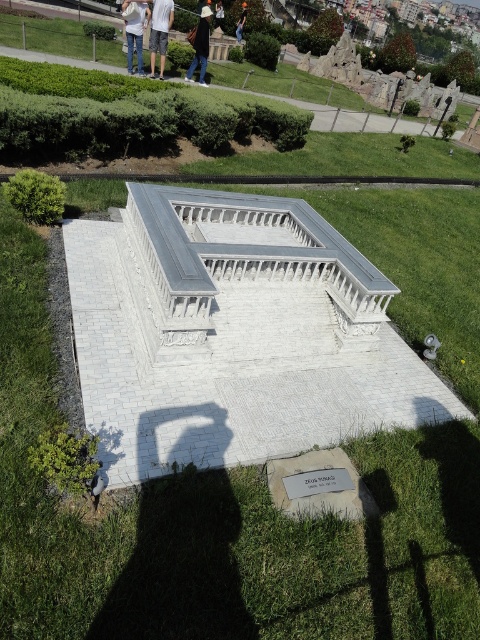
Question: Which object appears farthest from the camera in this image?

Choices:
 (A) white cotton shorts at center
 (B) black fabric bag at upper center
 (C) jeans at center
 (D) black cotton shirt at upper center

Answer: (D)

Question: Can you confirm if white cotton shorts at center is bigger than black fabric bag at upper center?

Choices:
 (A) no
 (B) yes

Answer: (B)

Question: Which of the following is the farthest from the observer?

Choices:
 (A) black fabric bag at upper center
 (B) jeans at center
 (C) black cotton shirt at upper center

Answer: (C)

Question: Can you confirm if jeans at center is smaller than black cotton shirt at upper center?

Choices:
 (A) yes
 (B) no

Answer: (A)

Question: Which is farther from the white cotton shorts at center?

Choices:
 (A) black fabric bag at upper center
 (B) black cotton shirt at upper center

Answer: (B)

Question: Is black fabric bag at upper center wider than black cotton shirt at upper center?

Choices:
 (A) yes
 (B) no

Answer: (B)